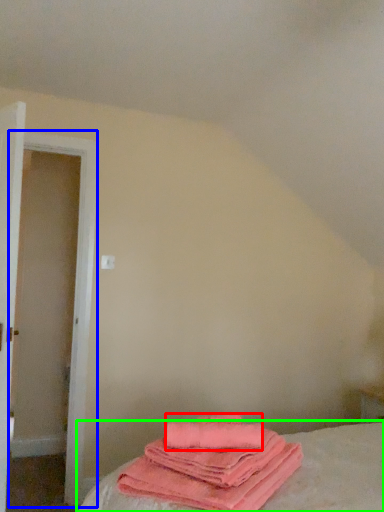
Question: Which object is the farthest from beach towel (highlighted by a red box)? Choose among these: door (highlighted by a blue box) or bed (highlighted by a green box).

Choices:
 (A) door
 (B) bed

Answer: (A)